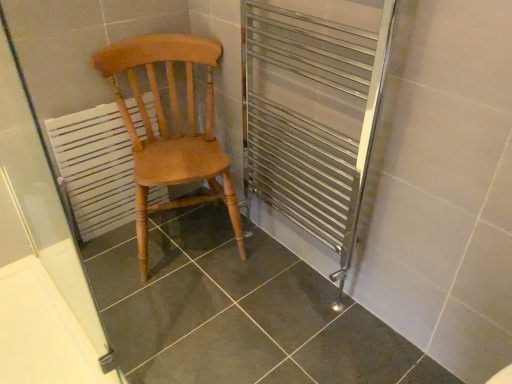
Question: Should I look upward or downward to see white painted wood radiator at left?

Choices:
 (A) down
 (B) up

Answer: (B)

Question: Is white painted wood radiator at left located outside white matte screen door at left?

Choices:
 (A) yes
 (B) no

Answer: (A)

Question: Would you say white painted wood radiator at left contains white matte screen door at left?

Choices:
 (A) no
 (B) yes

Answer: (A)

Question: From the image's perspective, is white painted wood radiator at left located above white matte screen door at left?

Choices:
 (A) no
 (B) yes

Answer: (B)

Question: Considering the relative sizes of white painted wood radiator at left and white matte screen door at left in the image provided, is white painted wood radiator at left bigger than white matte screen door at left?

Choices:
 (A) yes
 (B) no

Answer: (B)

Question: Is white painted wood radiator at left in front of white matte screen door at left?

Choices:
 (A) no
 (B) yes

Answer: (A)

Question: Is white painted wood radiator at left further to the viewer compared to white matte screen door at left?

Choices:
 (A) yes
 (B) no

Answer: (A)

Question: Does white matte screen door at left have a larger size compared to white painted wood radiator at left?

Choices:
 (A) yes
 (B) no

Answer: (A)

Question: From a real-world perspective, does white matte screen door at left stand above white painted wood radiator at left?

Choices:
 (A) yes
 (B) no

Answer: (A)

Question: Is white matte screen door at left directly adjacent to white painted wood radiator at left?

Choices:
 (A) yes
 (B) no

Answer: (B)

Question: Can we say white matte screen door at left lies outside white painted wood radiator at left?

Choices:
 (A) no
 (B) yes

Answer: (B)

Question: Could you tell me if white matte screen door at left is turned towards white painted wood radiator at left?

Choices:
 (A) no
 (B) yes

Answer: (A)

Question: Could white painted wood radiator at left be considered to be inside white matte screen door at left?

Choices:
 (A) yes
 (B) no

Answer: (B)

Question: From the image's perspective, would you say light brown wood chair at center is shown under white matte screen door at left?

Choices:
 (A) yes
 (B) no

Answer: (B)